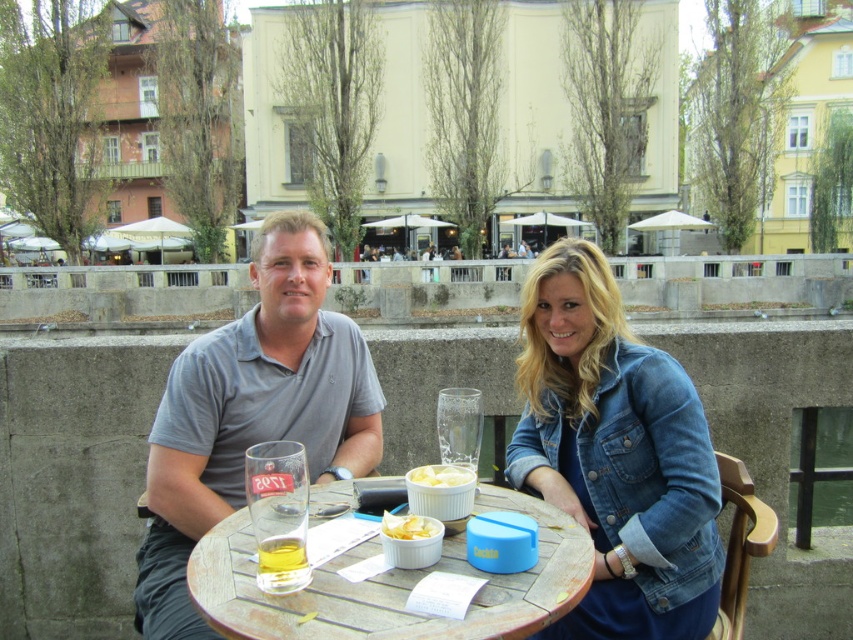
You are a painter standing at the riverside and want to paint the denim jacket at lower right and the wooden table at center. Which object should you focus on first if you want to paint the taller one first?

The denim jacket at lower right is taller than the wooden table at center, so you should focus on painting the denim jacket at lower right first.

You are a waiter at the riverside cafe and need to place a new order of a cocktail drink that requires a glass twice the width of the translucent glass cup at table center. Can you use the space where the denim jacket at lower right is currently placed?

The denim jacket at lower right might be wider than the translucent glass cup at table center, so if the new glass is twice the width of the translucent glass cup at table center, it could potentially fit in the space where the denim jacket is, provided the jacket is indeed wider. However, since the exact width isn

Consider the image. You are a waiter at the riverside cafe. You need to deliver a dessert to the customer wearing the denim jacket at lower right. The dessert is currently on the wooden table at center. Can you directly hand the dessert to the customer without moving the table or jacket?

The wooden table at center is behind the denim jacket at lower right, so the dessert on the wooden table at center is not directly accessible to the customer wearing the denim jacket at lower right. You would need to move either the table or the jacket to hand it over.